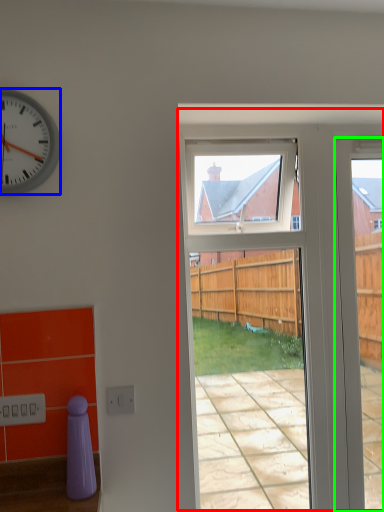
Question: Which object is positioned farthest from screen door (highlighted by a red box)? Select from clock (highlighted by a blue box) and door (highlighted by a green box).

Choices:
 (A) clock
 (B) door

Answer: (A)